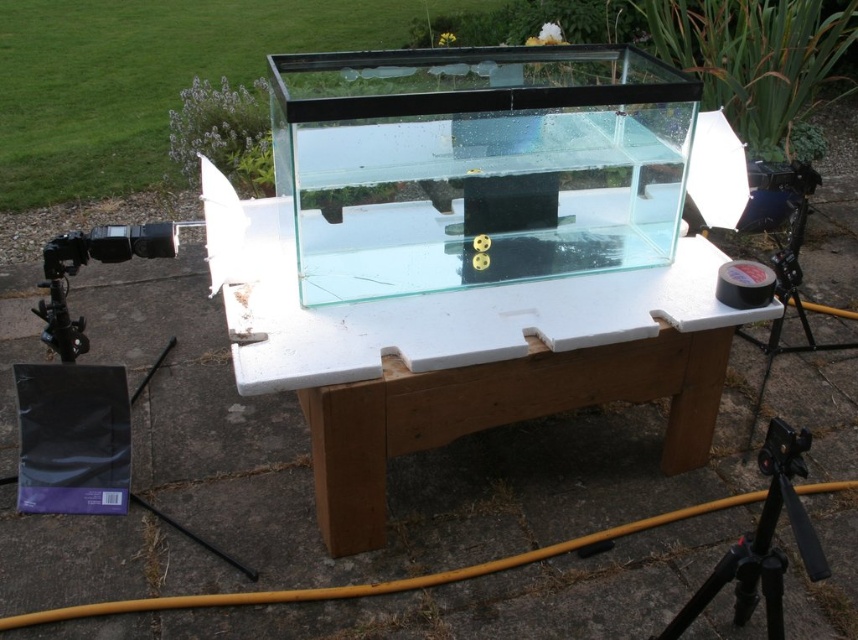
Question: Which point appears closest to the camera in this image?

Choices:
 (A) click(772, 321)
 (B) click(777, 442)
 (C) click(281, 280)

Answer: (B)

Question: Considering the real-world distances, which object is closest to the transparent plastic table at center?

Choices:
 (A) black rubber tape at right
 (B) black matte tripod at lower right

Answer: (B)

Question: Does transparent plastic table at center appear on the right side of black rubber tape at right?

Choices:
 (A) yes
 (B) no

Answer: (B)

Question: Which of these objects is positioned farthest from the black rubber tape at right?

Choices:
 (A) black matte tripod at lower right
 (B) transparent plastic table at center

Answer: (B)

Question: In this image, where is black matte tripod at lower right located relative to black rubber tape at right?

Choices:
 (A) right
 (B) left

Answer: (B)

Question: Is transparent plastic table at center further to camera compared to black rubber tape at right?

Choices:
 (A) yes
 (B) no

Answer: (B)